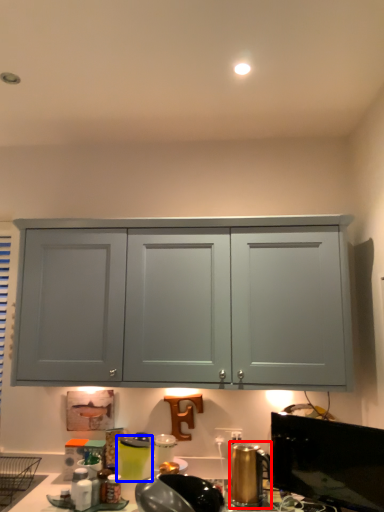
Question: Which object appears farthest to the camera in this image, appliance (highlighted by a red box) or appliance (highlighted by a blue box)?

Choices:
 (A) appliance
 (B) appliance

Answer: (B)